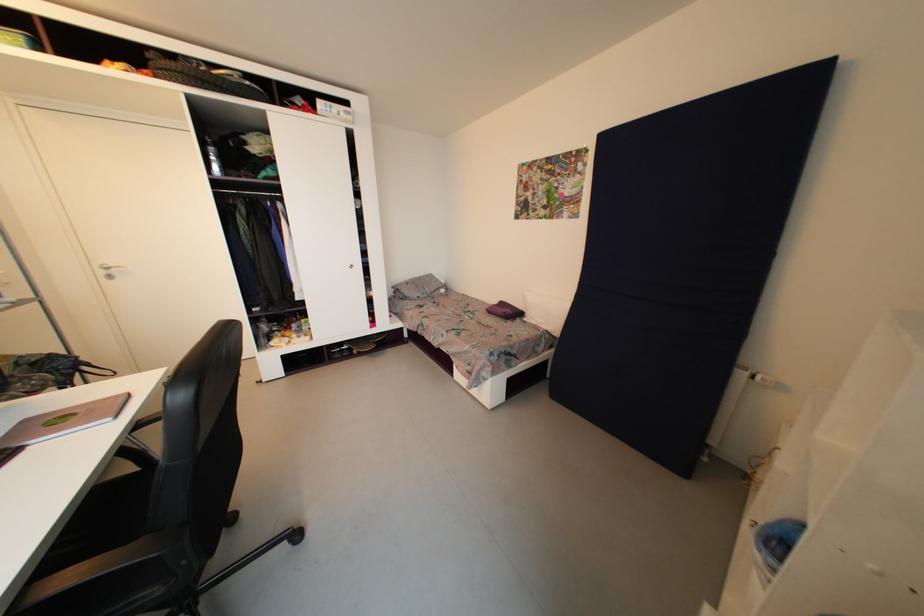
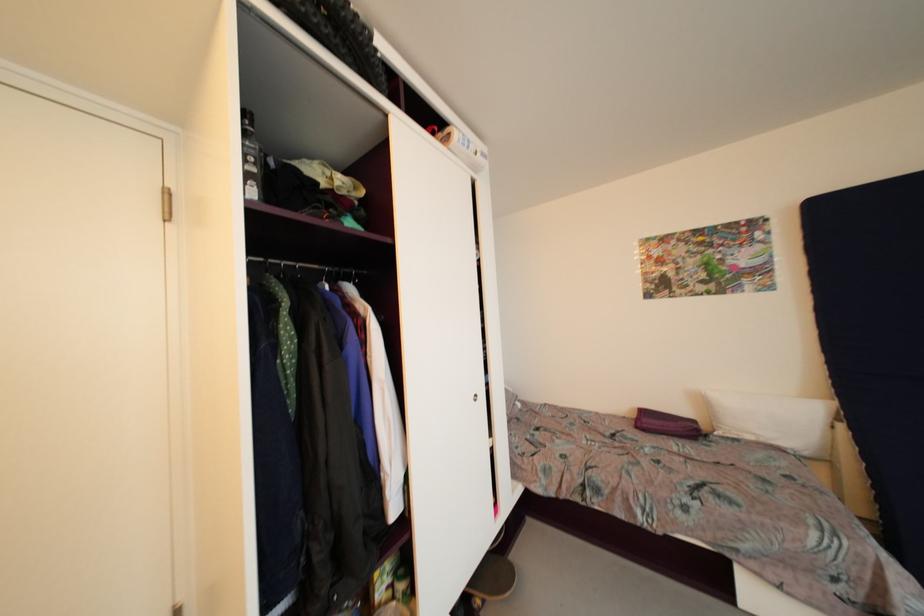
In a continuous first-person perspective shot, in which direction is the camera moving?

The movement direction of the cameraman is left, forward.